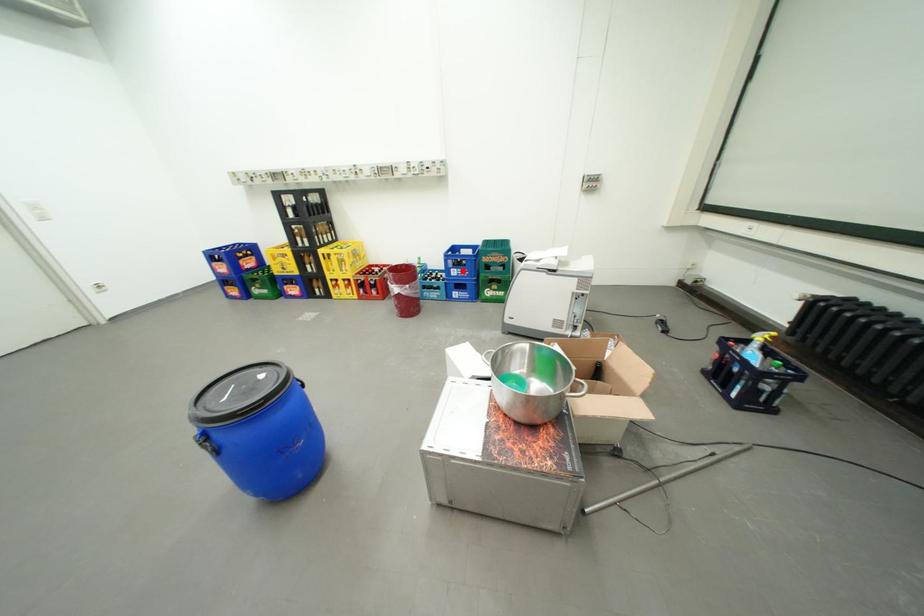
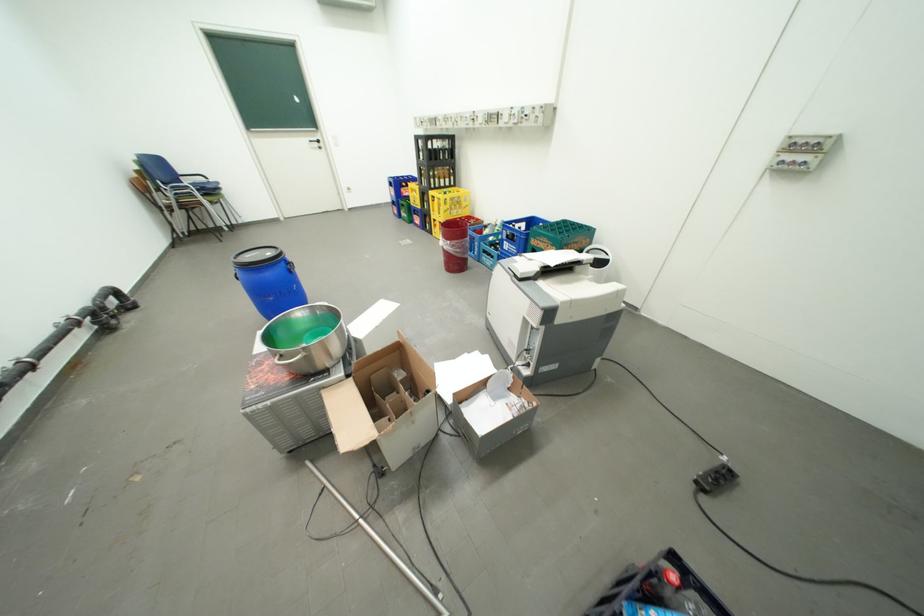
Question: I am providing you with two images of the same scene from different viewpoints. A red point is shown in image1. For the corresponding object point in image2, is it positioned nearer or farther from the camera?

Choices:
 (A) Nearer
 (B) Farther

Answer: (B)